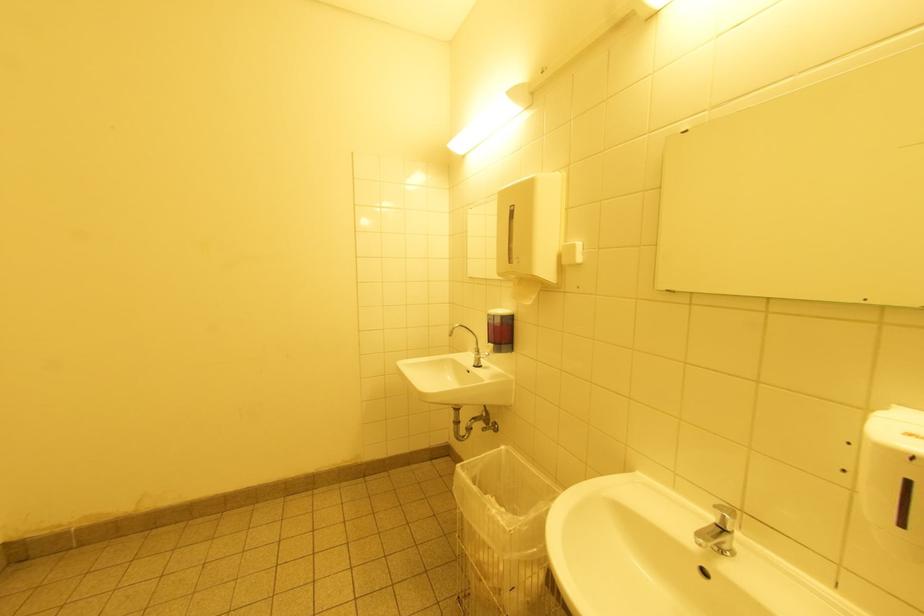
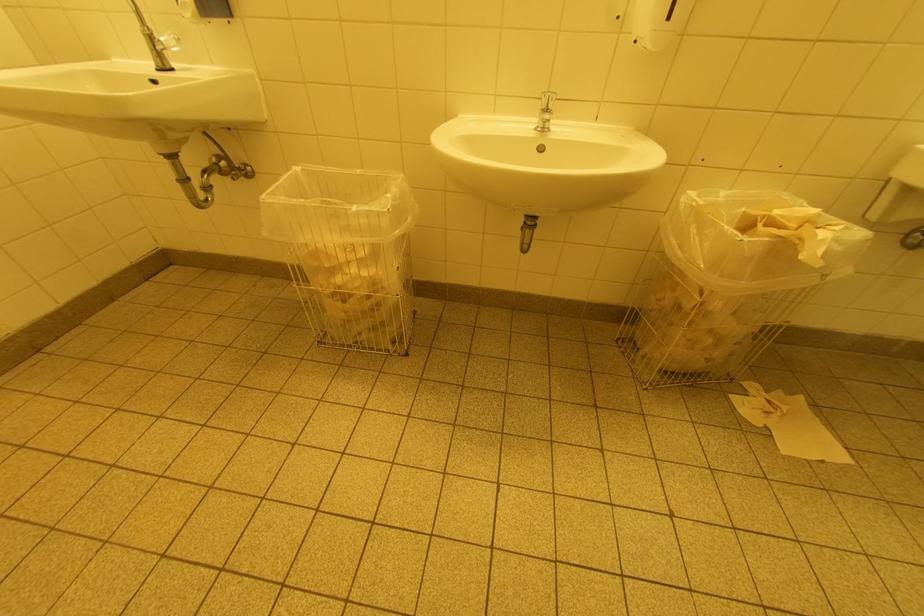
The first image is from the beginning of the video and the second image is from the end. How did the camera likely rotate when shooting the video?

The camera rotated toward right-down.